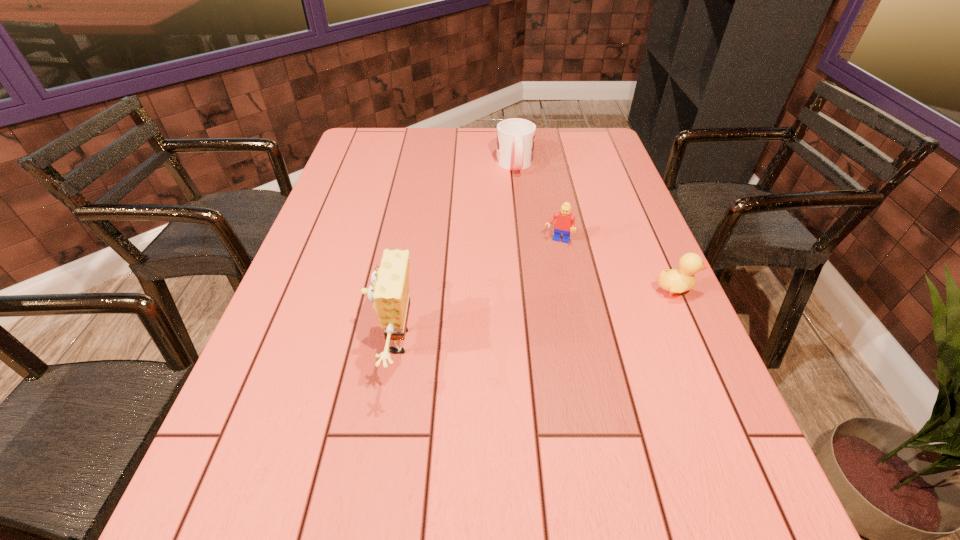
Image resolution: width=960 pixels, height=540 pixels. Identify the location of the leftmost object. (389, 291).

The width and height of the screenshot is (960, 540). I want to click on sponge, so click(x=389, y=291).

Where is `duckling`? duckling is located at coordinates (680, 280).

Identify the location of mug. This screenshot has width=960, height=540. (515, 140).

Identify the location of the third nearest object. (565, 223).

Where is `vacant space located on the face of the leftmost object`? vacant space located on the face of the leftmost object is located at coordinates (332, 342).

Identify the location of free location located 0.100m on the face of the leftmost object. (328, 342).

Locate an element on the screen. vacant space located 0.140m on the face of the leftmost object is located at coordinates (309, 342).

This screenshot has height=540, width=960. What are the coordinates of `free space located 0.110m on the side of the farthest object with the handle` in the screenshot? It's located at pos(520,199).

The height and width of the screenshot is (540, 960). What are the coordinates of `free space located on the side of the farthest object with the handle` in the screenshot? It's located at (530, 247).